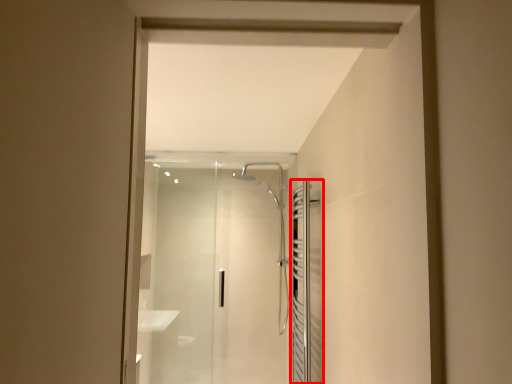
Question: Where is screen door (annotated by the red box) located in relation to screen door in the image?

Choices:
 (A) right
 (B) left

Answer: (A)